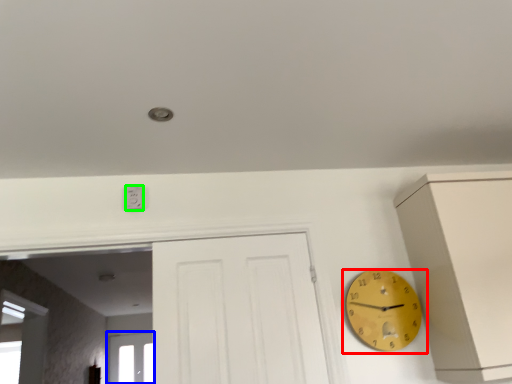
Question: Which object is the farthest from wall clock (highlighted by a red box)? Choose among these: window (highlighted by a blue box) or electric outlet (highlighted by a green box).

Choices:
 (A) window
 (B) electric outlet

Answer: (A)